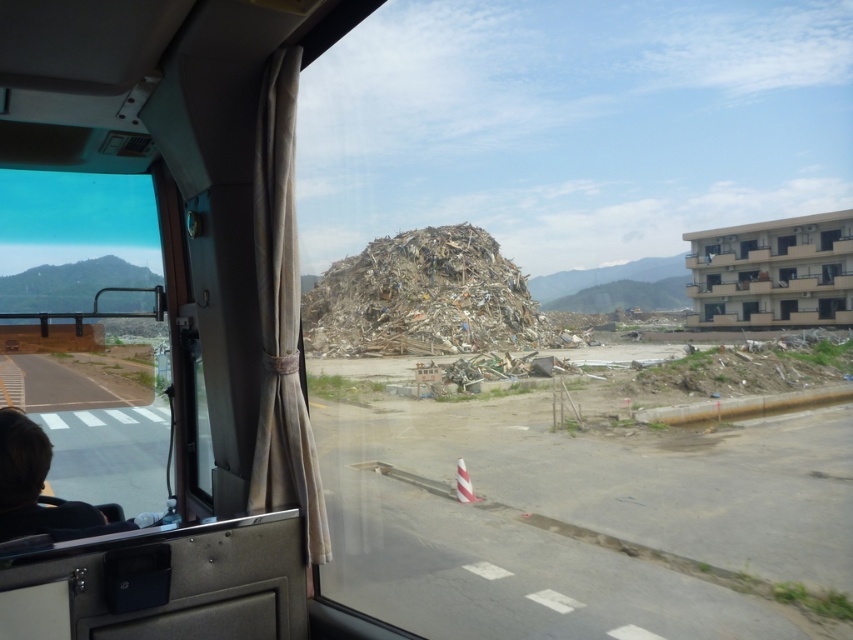
Question: Does brown shredded debris at center have a larger size compared to transparent glass window at center?

Choices:
 (A) yes
 (B) no

Answer: (A)

Question: Can you confirm if brown shredded debris at center is positioned below transparent glass window at center?

Choices:
 (A) yes
 (B) no

Answer: (A)

Question: Is dark brown hair at lower left thinner than transparent glass window at center?

Choices:
 (A) yes
 (B) no

Answer: (A)

Question: Considering the real-world distances, which object is farthest from the dark brown hair at lower left?

Choices:
 (A) transparent glass window at center
 (B) brown shredded debris at center

Answer: (A)

Question: Estimate the real-world distances between objects in this image. Which object is closer to the dark brown hair at lower left?

Choices:
 (A) brown shredded debris at center
 (B) transparent glass window at center

Answer: (A)

Question: Which point is farther from the camera taking this photo?

Choices:
 (A) (26, 500)
 (B) (383, 342)

Answer: (B)